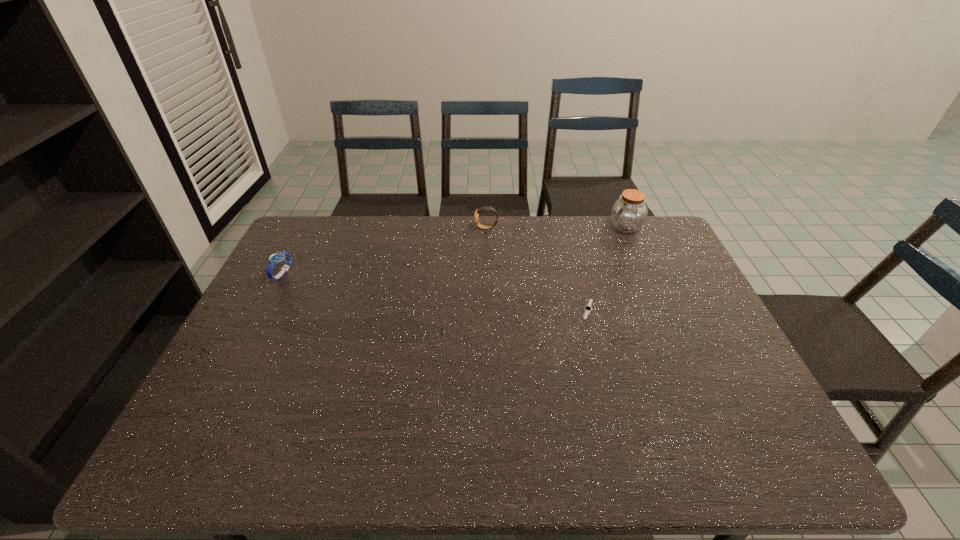
Where is `vacant space located on the face of the tallest watch`? This screenshot has height=540, width=960. vacant space located on the face of the tallest watch is located at coordinates (366, 228).

The height and width of the screenshot is (540, 960). In order to click on vacant space positioned 0.300m on the face of the tallest watch in this screenshot , I will do 391,228.

Where is `free space located on the back of the second nearest watch`? The width and height of the screenshot is (960, 540). free space located on the back of the second nearest watch is located at coordinates (302, 236).

The image size is (960, 540). What are the coordinates of `free space located 0.050m on the front of the nearest object` in the screenshot? It's located at (594, 333).

Locate an element on the screen. jar that is at the far edge is located at coordinates (629, 213).

The image size is (960, 540). I want to click on watch that is at the far edge, so pyautogui.click(x=485, y=208).

Identify the location of object that is positioned at the left edge. The width and height of the screenshot is (960, 540). (276, 258).

Find the location of a particular element. Image resolution: width=960 pixels, height=540 pixels. object present at the right edge is located at coordinates (629, 213).

Identify the location of object that is at the far right corner. The height and width of the screenshot is (540, 960). [x=629, y=213].

This screenshot has width=960, height=540. What are the coordinates of `vacant area at the far edge` in the screenshot? It's located at pyautogui.click(x=487, y=221).